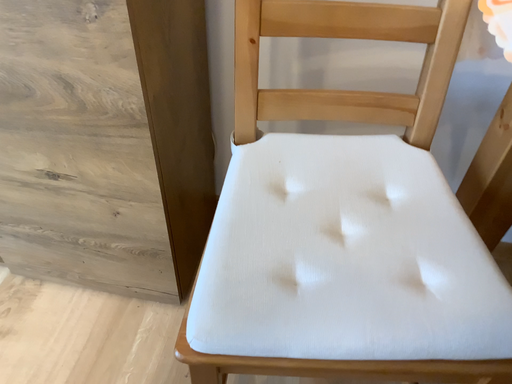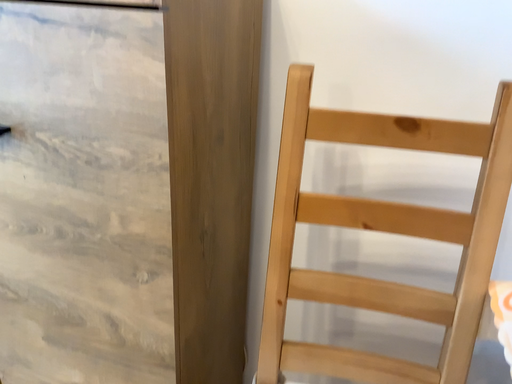
Question: How did the camera likely rotate when shooting the video?

Choices:
 (A) rotated downward
 (B) rotated upward

Answer: (B)